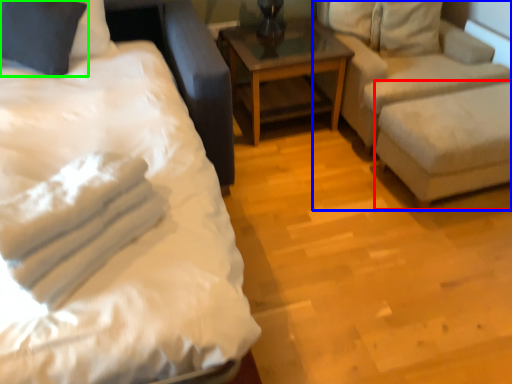
Question: Which object is positioned farthest from swivel chair (highlighted by a red box)? Select from studio couch (highlighted by a blue box) and pillow (highlighted by a green box).

Choices:
 (A) studio couch
 (B) pillow

Answer: (B)